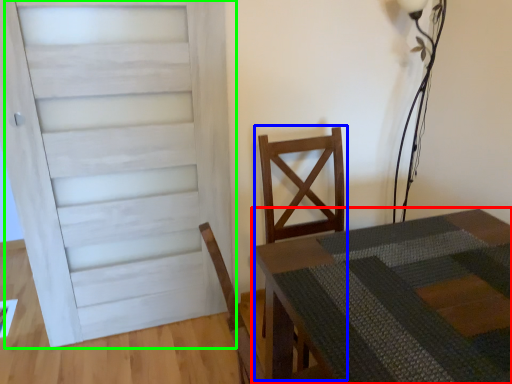
Question: Which object is positioned farthest from table (highlighted by a red box)? Select from armchair (highlighted by a blue box) and door (highlighted by a green box).

Choices:
 (A) armchair
 (B) door

Answer: (B)